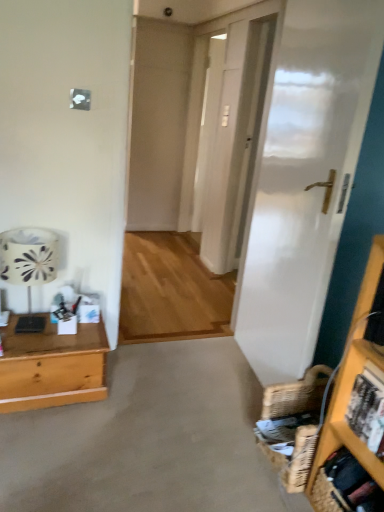
Find the location of a particular element. The height and width of the screenshot is (512, 384). free space above wooden desk at left (from a real-world perspective) is located at coordinates (50, 334).